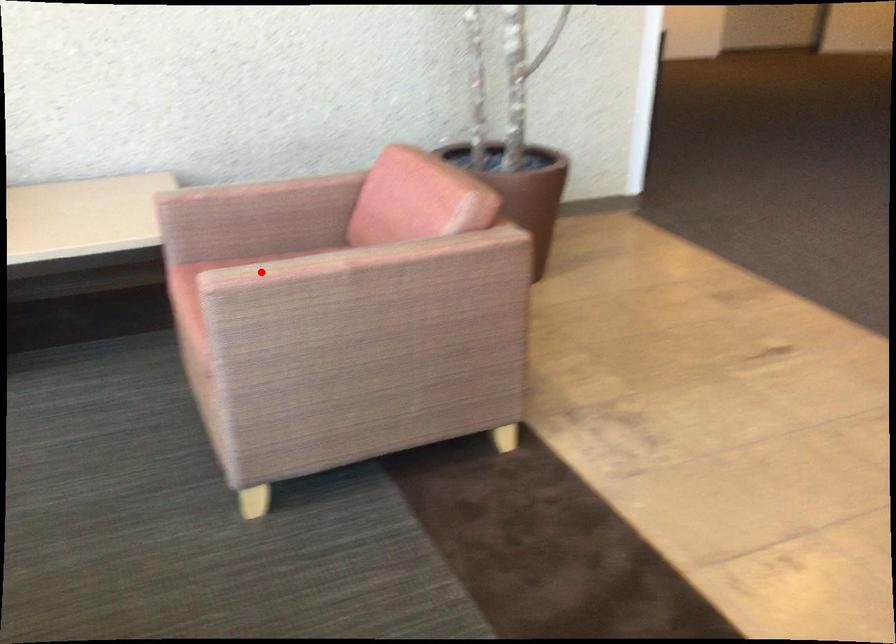
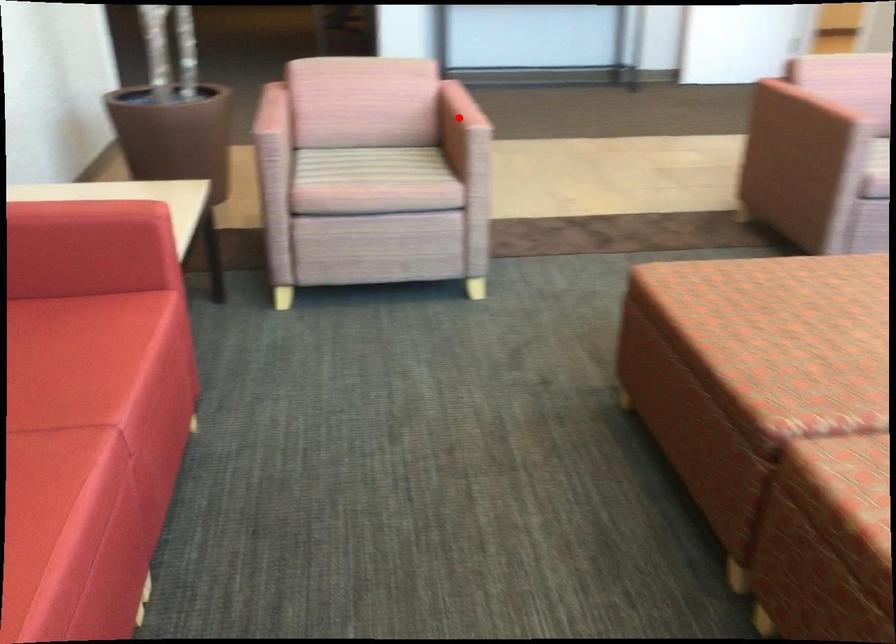
Consider the image. I am providing you with two images of the same scene from different viewpoints. A red point is marked on the first image and another point is marked on the second image. Is the marked point in image1 the same physical position as the marked point in image2?

Yes